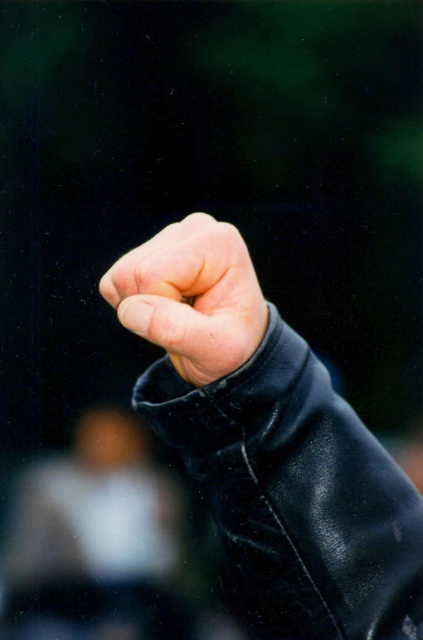
Question: Can you confirm if black leather jacket at center is positioned above leather fist at center?

Choices:
 (A) no
 (B) yes

Answer: (A)

Question: Is black leather jacket at center thinner than leather fist at center?

Choices:
 (A) no
 (B) yes

Answer: (A)

Question: Among these points, which one is nearest to the camera?

Choices:
 (A) (145, 301)
 (B) (280, 317)

Answer: (A)

Question: Is the position of black leather jacket at center more distant than that of leather fist at center?

Choices:
 (A) no
 (B) yes

Answer: (B)